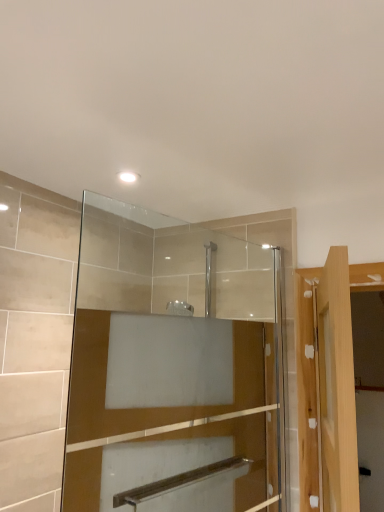
Question: Is transparent glass mirror at upper center to the left or to the right of light wood door at right in the image?

Choices:
 (A) left
 (B) right

Answer: (A)

Question: In terms of width, does transparent glass mirror at upper center look wider or thinner when compared to light wood door at right?

Choices:
 (A) thin
 (B) wide

Answer: (A)

Question: Is transparent glass mirror at upper center taller or shorter than light wood door at right?

Choices:
 (A) short
 (B) tall

Answer: (B)

Question: In the image, is light wood door at right on the left side or the right side of transparent glass mirror at upper center?

Choices:
 (A) right
 (B) left

Answer: (A)

Question: From the image's perspective, relative to transparent glass mirror at upper center, is light wood door at right above or below?

Choices:
 (A) above
 (B) below

Answer: (B)

Question: Is point (349, 483) closer or farther from the camera than point (160, 374)?

Choices:
 (A) farther
 (B) closer

Answer: (B)

Question: In terms of size, does light wood door at right appear bigger or smaller than transparent glass mirror at upper center?

Choices:
 (A) small
 (B) big

Answer: (B)